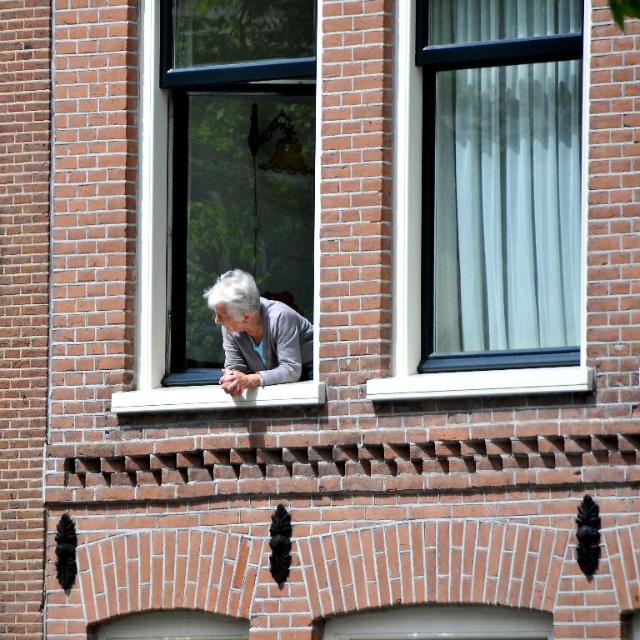
Question: Which point is closer to the camera?

Choices:
 (A) white painted wood at lower center
 (B) clear glass window at center

Answer: (A)

Question: Can you confirm if white sheer curtain at upper right is smaller than white painted wood at lower center?

Choices:
 (A) no
 (B) yes

Answer: (B)

Question: In this image, where is clear glass window at center located relative to gray matte sweater at center?

Choices:
 (A) below
 (B) above

Answer: (B)

Question: Which point is closer to the camera?

Choices:
 (A) gray matte sweater at center
 (B) clear glass window at center
 (C) white painted wood at lower center
 (D) white sheer curtain at upper right

Answer: (D)

Question: Can you confirm if white sheer curtain at upper right is wider than gray matte sweater at center?

Choices:
 (A) yes
 (B) no

Answer: (B)

Question: Which object is positioned closest to the clear glass window at center?

Choices:
 (A) white sheer curtain at upper right
 (B) gray matte sweater at center
 (C) white painted wood at lower center

Answer: (B)